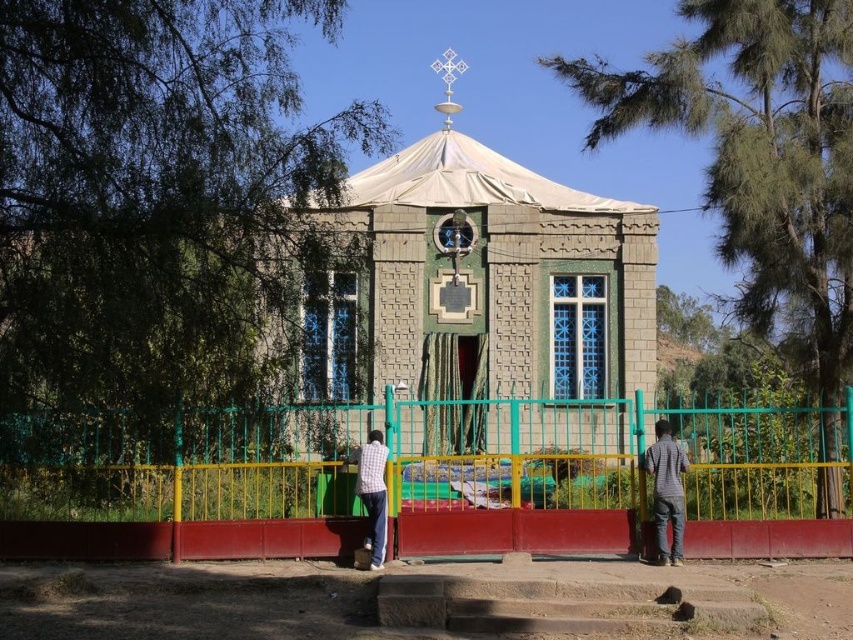
Question: Among these points, which one is nearest to the camera?

Choices:
 (A) (659, 420)
 (B) (368, 474)
 (C) (614, 540)

Answer: (C)

Question: Estimate the real-world distances between objects in this image. Which object is farther from the gray striped shirt at right?

Choices:
 (A) green metal fence at center
 (B) checkered fabric shirt at center

Answer: (B)

Question: Where is gray striped shirt at right located in relation to checkered fabric shirt at center in the image?

Choices:
 (A) right
 (B) left

Answer: (A)

Question: Which object is farther from the camera taking this photo?

Choices:
 (A) green metal fence at center
 (B) gray striped shirt at right
 (C) checkered fabric shirt at center

Answer: (B)

Question: Does gray striped shirt at right come in front of checkered fabric shirt at center?

Choices:
 (A) no
 (B) yes

Answer: (A)

Question: Can you confirm if green metal fence at center is bigger than checkered fabric shirt at center?

Choices:
 (A) yes
 (B) no

Answer: (A)